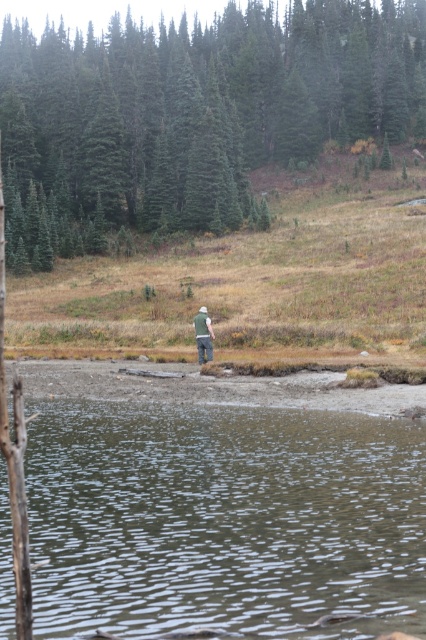
Which is above, greenish-brown water at lower center or camouflage fabric jacket at center?

camouflage fabric jacket at center is above.

Is greenish-brown water at lower center to the right of camouflage fabric jacket at center from the viewer's perspective?

Yes, greenish-brown water at lower center is to the right of camouflage fabric jacket at center.

Who is more forward, (417, 492) or (198, 317)?

Positioned in front is point (417, 492).

Find the location of a particular element. This screenshot has height=640, width=426. greenish-brown water at lower center is located at coordinates (224, 518).

Does greenish-brown water at lower center appear on the left side of green matte tree at upper center?

In fact, greenish-brown water at lower center is to the right of green matte tree at upper center.

Is point (310, 492) in front of point (5, 60)?

Yes, point (310, 492) is closer to viewer.

Does point (124, 460) come behind point (129, 195)?

No, it is in front of (129, 195).

Image resolution: width=426 pixels, height=640 pixels. I want to click on greenish-brown water at lower center, so click(x=224, y=518).

Between green matte tree at upper center and camouflage fabric jacket at center, which one is positioned higher?

Positioned higher is green matte tree at upper center.

Is green matte tree at upper center taller than camouflage fabric jacket at center?

Yes.

Where is `green matte tree at upper center`? The image size is (426, 640). green matte tree at upper center is located at coordinates (193, 113).

At what (x,y) coordinates should I click in order to perform the action: click on green matte tree at upper center. Please return your answer as a coordinate pair (x, y). Looking at the image, I should click on (193, 113).